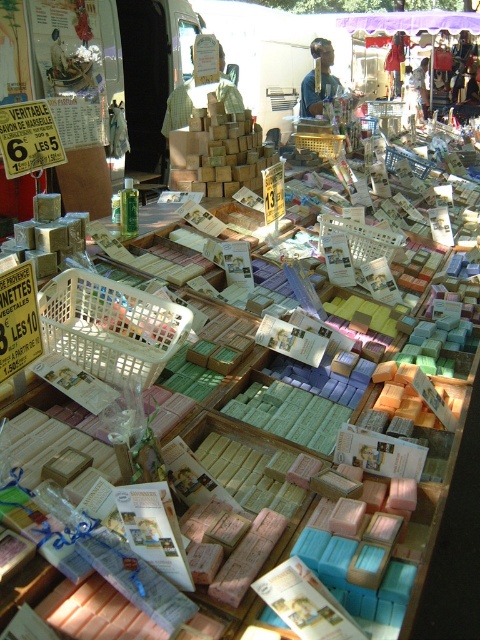
Question: Which point is farther from the camera taking this photo?

Choices:
 (A) (310, 104)
 (B) (417, 68)

Answer: (B)

Question: Which of the following is the farthest from the observer?

Choices:
 (A) matte brown wooden stick at upper center
 (B) matte white shirt at upper center

Answer: (B)

Question: Which object appears closest to the camera in this image?

Choices:
 (A) matte brown wooden stick at upper center
 (B) matte white shirt at upper center

Answer: (A)

Question: Can you confirm if matte brown wooden stick at upper center is thinner than matte white shirt at upper center?

Choices:
 (A) no
 (B) yes

Answer: (B)

Question: Is matte brown wooden stick at upper center below matte white shirt at upper center?

Choices:
 (A) yes
 (B) no

Answer: (A)

Question: Is matte brown wooden stick at upper center above matte white shirt at upper center?

Choices:
 (A) no
 (B) yes

Answer: (A)